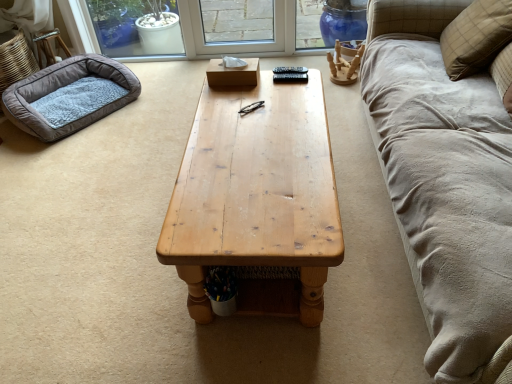
In order to click on free location to the left of natural wood coffee table at center in this screenshot , I will do `click(101, 250)`.